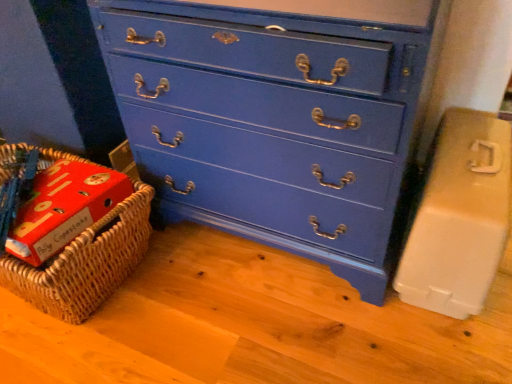
The width and height of the screenshot is (512, 384). Find the location of `free location to the right of woven brown basket at lower left`. free location to the right of woven brown basket at lower left is located at coordinates (205, 299).